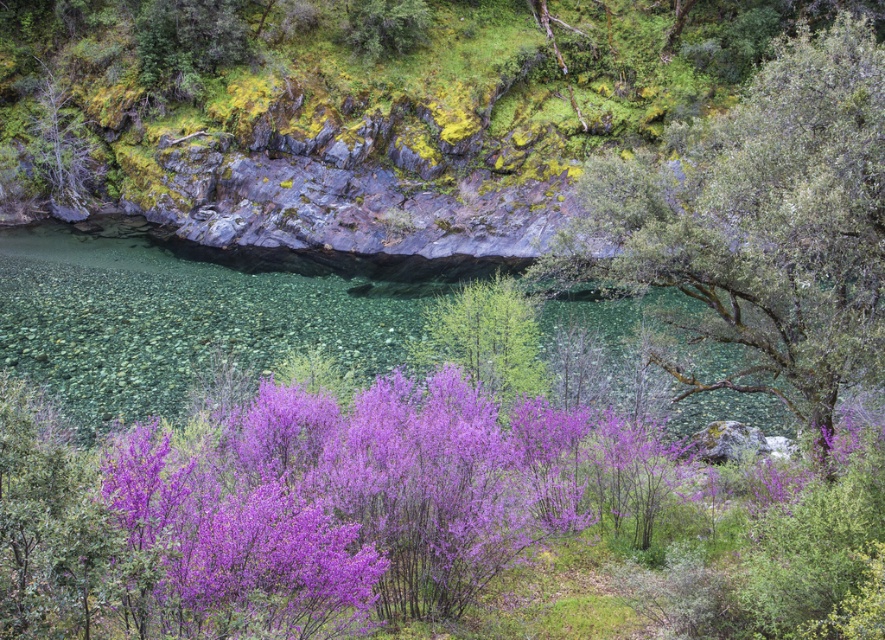
Can you confirm if purple matte flowers at center is shorter than green leafy tree at upper right?

Indeed, purple matte flowers at center has a lesser height compared to green leafy tree at upper right.

Is purple matte flowers at center closer to the viewer compared to green leafy tree at upper right?

Yes, purple matte flowers at center is in front of green leafy tree at upper right.

I want to click on purple matte flowers at center, so click(x=358, y=502).